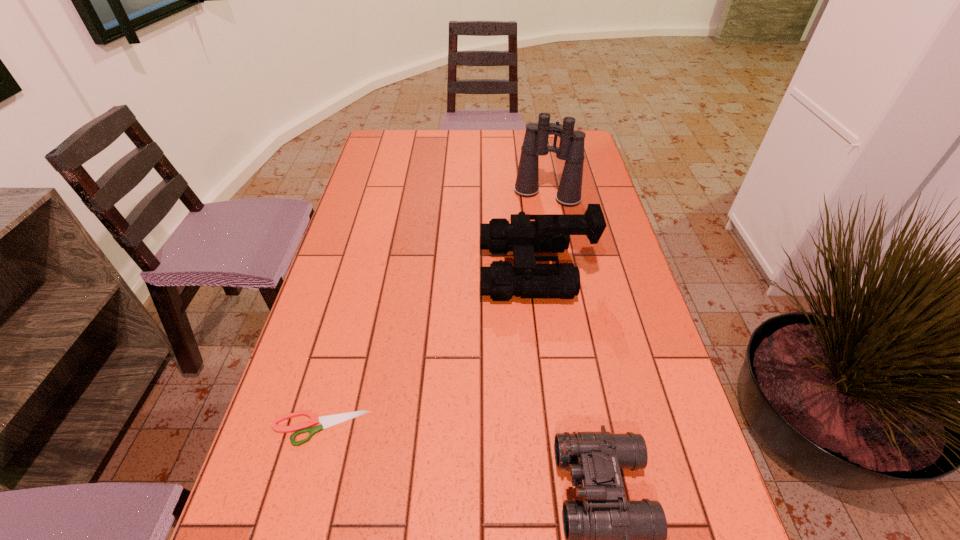
Locate an element on the screen. The image size is (960, 540). free space located 0.150m on the front of the scissors is located at coordinates (291, 535).

Where is `object present at the left edge`? The width and height of the screenshot is (960, 540). object present at the left edge is located at coordinates (328, 421).

Identify the location of vacant space at the far edge of the desktop. (431, 131).

In the image, there is a desktop. Where is `free space at the left edge`? The height and width of the screenshot is (540, 960). free space at the left edge is located at coordinates (363, 229).

Find the location of a particular element. Image resolution: width=960 pixels, height=540 pixels. vacant space at the right edge of the desktop is located at coordinates (602, 188).

Select which object appears as the second closest to the second shortest object. Please provide its 2D coordinates. Your answer should be formatted as a tuple, i.e. [(x, y)], where the tuple contains the x and y coordinates of a point satisfying the conditions above.

[(328, 421)]

Locate which object is the closest to the scissors. Please provide its 2D coordinates. Your answer should be formatted as a tuple, i.e. [(x, y)], where the tuple contains the x and y coordinates of a point satisfying the conditions above.

[(551, 232)]

Find the location of a particular element. the second closest binoculars to the shortest object is located at coordinates (608, 539).

Select which binoculars appears as the second closest to the second shortest binoculars. Please provide its 2D coordinates. Your answer should be formatted as a tuple, i.e. [(x, y)], where the tuple contains the x and y coordinates of a point satisfying the conditions above.

[(608, 539)]

Where is `vacant region that satisfies the following two spatial constraints: 1. on the front side of the tallest binoculars; 2. on the front lenses of the second tallest binoculars`? vacant region that satisfies the following two spatial constraints: 1. on the front side of the tallest binoculars; 2. on the front lenses of the second tallest binoculars is located at coordinates (561, 270).